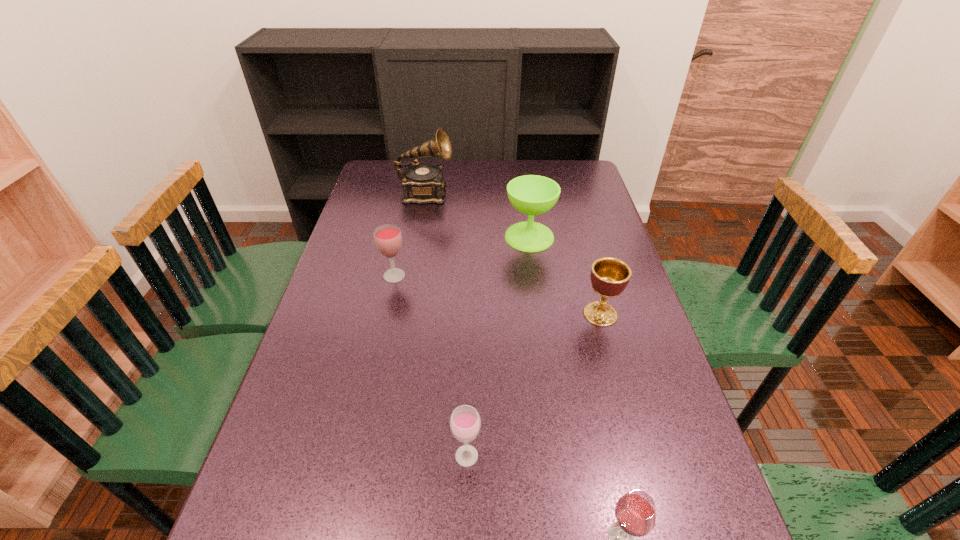
Find the location of a particular element. The width and height of the screenshot is (960, 540). vacant space positioned on the right of the fourth nearest object is located at coordinates (438, 276).

Locate an element on the screen. Image resolution: width=960 pixels, height=540 pixels. vacant area situated 0.390m on the back of the chalice is located at coordinates (574, 220).

Locate an element on the screen. Image resolution: width=960 pixels, height=540 pixels. vacant region located 0.060m on the left of the third object from left to right is located at coordinates (422, 456).

This screenshot has width=960, height=540. What are the coordinates of `object that is at the far edge` in the screenshot? It's located at (422, 183).

Image resolution: width=960 pixels, height=540 pixels. Identify the location of phonograph record located at the left edge. (422, 183).

Locate an element on the screen. wineglass that is at the left edge is located at coordinates [x=388, y=239].

This screenshot has width=960, height=540. Find the location of `object present at the right edge`. object present at the right edge is located at coordinates (609, 276).

Where is `object located at the far left corner`? Image resolution: width=960 pixels, height=540 pixels. object located at the far left corner is located at coordinates (422, 183).

Where is `free space at the far edge of the desktop`? free space at the far edge of the desktop is located at coordinates (462, 187).

Image resolution: width=960 pixels, height=540 pixels. I want to click on blank space at the left edge, so click(x=292, y=470).